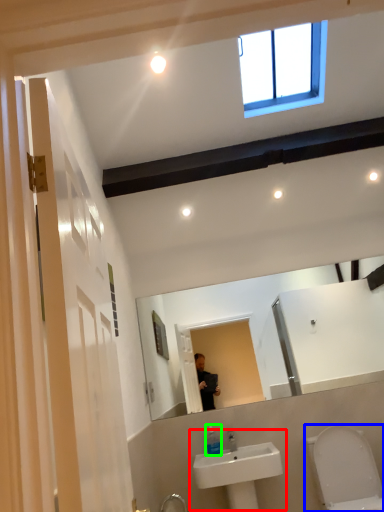
Question: Considering the real-world distances, which object is farthest from sink (highlighted by a red box)? toilet (highlighted by a blue box) or soap dispenser (highlighted by a green box)?

Choices:
 (A) toilet
 (B) soap dispenser

Answer: (A)